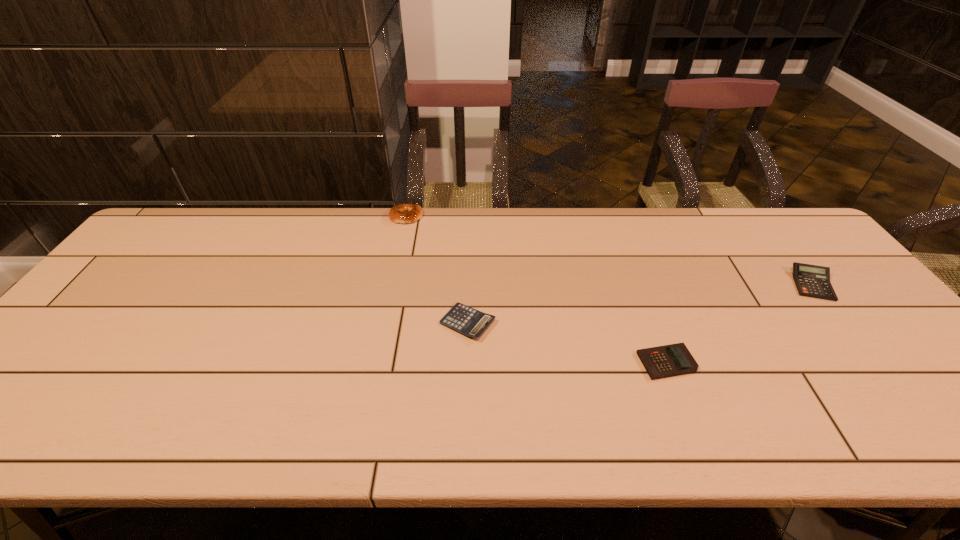
At what (x,y) coordinates should I click in order to perform the action: click on the leftmost object. Please return your answer as a coordinate pair (x, y). The width and height of the screenshot is (960, 540). Looking at the image, I should click on (402, 213).

You are a GUI agent. You are given a task and a screenshot of the screen. Output one action in this format:
    pyautogui.click(x=<x>, y=<y>)
    Task: Click on the farthest object
    This screenshot has height=540, width=960.
    Given the screenshot: What is the action you would take?
    pyautogui.click(x=402, y=213)

The image size is (960, 540). In order to click on the farthest calculator in this screenshot , I will do `click(813, 281)`.

Locate an element on the screen. Image resolution: width=960 pixels, height=540 pixels. the rightmost calculator is located at coordinates (813, 281).

The width and height of the screenshot is (960, 540). I want to click on the nearest object, so click(x=671, y=360).

The height and width of the screenshot is (540, 960). I want to click on the nearest calculator, so click(x=671, y=360).

Locate an element on the screen. the second object from left to right is located at coordinates [468, 321].

This screenshot has width=960, height=540. Find the location of `the leftmost calculator`. the leftmost calculator is located at coordinates (468, 321).

Where is `vacant area situated on the front of the bagel`? This screenshot has height=540, width=960. vacant area situated on the front of the bagel is located at coordinates (396, 269).

Locate an element on the screen. This screenshot has width=960, height=540. free spot located 0.210m on the back of the farthest calculator is located at coordinates (765, 226).